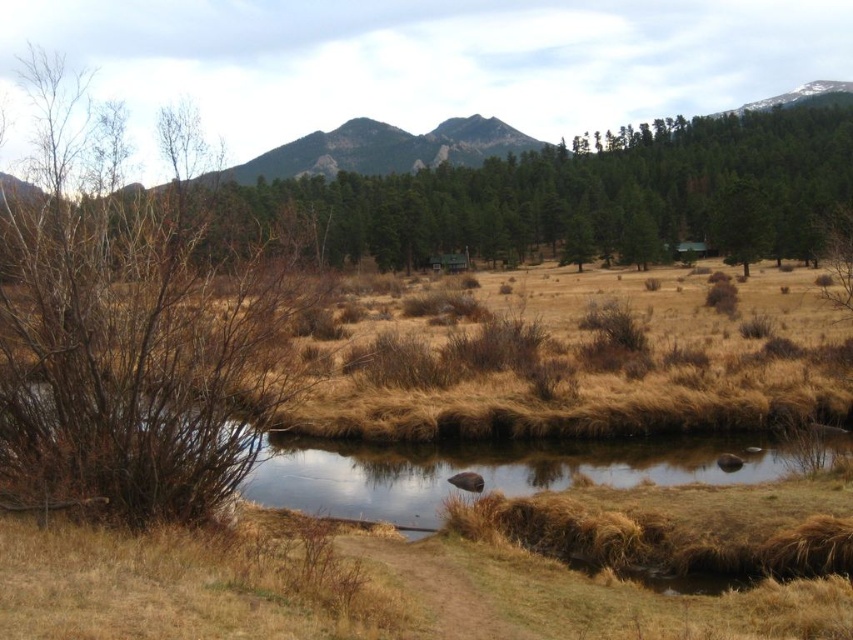
Based on the photo, you are an environmental scientist assessing the landscape. You observe the brown bare branches at left and the green matte tree at upper center. Which of these two objects is taller?

The green matte tree at upper center is taller than the brown bare branches at left.

You are standing in the meadow and want to take a photo of the brown bare branches at left. Where should you position yourself to capture the branches in the frame?

To capture the brown bare branches at left in your photo, position yourself at point [138,321].